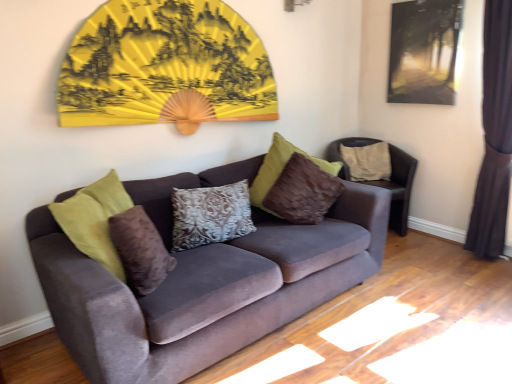
Question: In terms of width, does velvet brown chair at right look wider or thinner when compared to matte black picture frame at upper right?

Choices:
 (A) wide
 (B) thin

Answer: (A)

Question: In terms of height, does velvet brown chair at right look taller or shorter compared to matte black picture frame at upper right?

Choices:
 (A) tall
 (B) short

Answer: (A)

Question: Which object is positioned farthest from the dark brown velvet curtain at right?

Choices:
 (A) velvet brown chair at right
 (B) yellow paper fan at upper center
 (C) velvet couch at center
 (D) brown velvet pillow at center, the first pillow when ordered from left to right
 (E) matte black picture frame at upper right

Answer: (D)

Question: Which of these objects is positioned farthest from the yellow paper fan at upper center?

Choices:
 (A) dark brown velvet curtain at right
 (B) patterned fabric pillow at center, which is the second pillow from front to back
 (C) beige fabric pillow at right, which ranks as the 1th pillow in right-to-left order
 (D) brown velvet pillow at center, positioned as the 3th pillow in back-to-front order
 (E) velvet couch at center

Answer: (A)